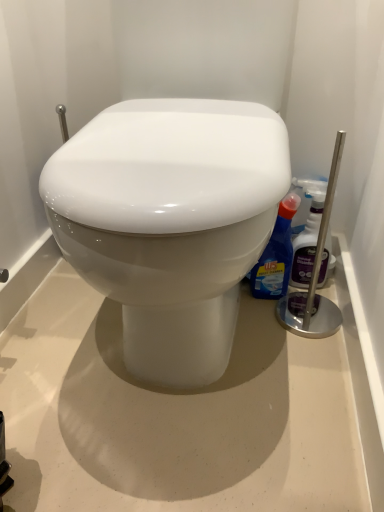
Question: Is point (314, 245) positioned closer to the camera than point (258, 292)?

Choices:
 (A) closer
 (B) farther

Answer: (A)

Question: Visually, is translucent plastic spray bottle at right, arranged as the 1th cleaning product when viewed from the right, positioned to the left or to the right of blue glossy toilet cleaner at right, which is the first cleaning product in left-to-right order?

Choices:
 (A) right
 (B) left

Answer: (A)

Question: Considering the positions of translucent plastic spray bottle at right, which is the second cleaning product from left to right, and blue glossy toilet cleaner at right, marked as the 2th cleaning product in a right-to-left arrangement, in the image, is translucent plastic spray bottle at right, which is the second cleaning product from left to right, bigger or smaller than blue glossy toilet cleaner at right, marked as the 2th cleaning product in a right-to-left arrangement,?

Choices:
 (A) small
 (B) big

Answer: (A)

Question: Would you say blue glossy toilet cleaner at right, which is the first cleaning product in left-to-right order, is inside or outside translucent plastic spray bottle at right, arranged as the 1th cleaning product when viewed from the right?

Choices:
 (A) inside
 (B) outside

Answer: (B)

Question: Looking at the image, does blue glossy toilet cleaner at right, which is the first cleaning product in left-to-right order, seem bigger or smaller compared to translucent plastic spray bottle at right, which is the second cleaning product from left to right?

Choices:
 (A) small
 (B) big

Answer: (B)

Question: From their relative heights in the image, would you say blue glossy toilet cleaner at right, which is the first cleaning product in left-to-right order, is taller or shorter than translucent plastic spray bottle at right, arranged as the 1th cleaning product when viewed from the right?

Choices:
 (A) short
 (B) tall

Answer: (A)

Question: From a real-world perspective, relative to translucent plastic spray bottle at right, arranged as the 1th cleaning product when viewed from the right, is blue glossy toilet cleaner at right, which is the first cleaning product in left-to-right order, vertically above or below?

Choices:
 (A) below
 (B) above

Answer: (A)